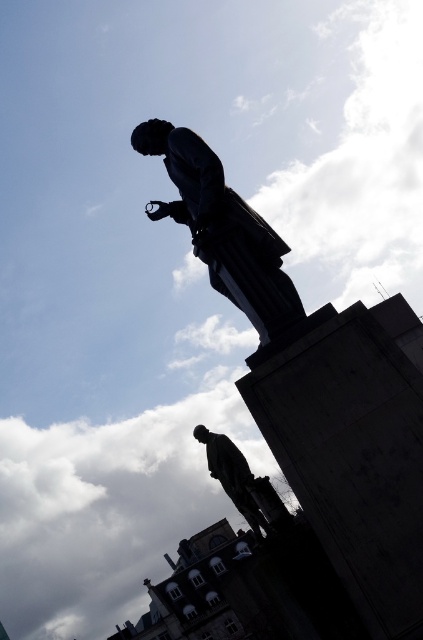
You are an art curator planning to move the two polished bronze statues into a new exhibition space. The entrance of the exhibition hall has a height restriction of 2 meters. Given that the polished bronze statue at upper center is much taller than the polished bronze statue at center, which statue might require special handling to ensure it meets the height requirement?

The polished bronze statue at upper center is much taller than the polished bronze statue at center, so it might require special handling to ensure it meets the height requirement of the exhibition hall entrance.

You are standing in front of two statues. You notice two specific points marked on them. The first point is at coordinate point (208, 147) and the second is at point (236, 493). Which of these points is closer to your viewpoint?

Point (208, 147) is closer to the camera than point (236, 493), so the first point is closer to your viewpoint.